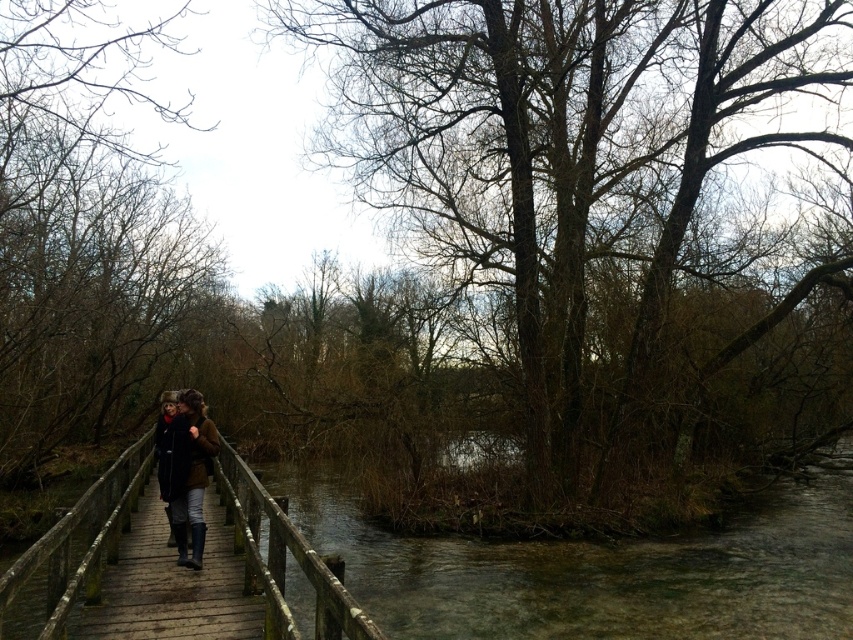
Question: Considering the relative positions of brown leather jacket at center and black leather coat at center in the image provided, where is brown leather jacket at center located with respect to black leather coat at center?

Choices:
 (A) above
 (B) below

Answer: (A)

Question: Does wooden planks at center have a greater width compared to brown leather jacket at center?

Choices:
 (A) yes
 (B) no

Answer: (B)

Question: Which point is closer to the camera taking this photo?

Choices:
 (A) (94, 502)
 (B) (740, 589)
 (C) (166, 406)
 (D) (198, 412)

Answer: (A)

Question: Which object appears closest to the camera in this image?

Choices:
 (A) black leather coat at center
 (B) brown leather jacket at center

Answer: (B)

Question: From the image, what is the correct spatial relationship of clear water at center in relation to wooden planks at center?

Choices:
 (A) right
 (B) left

Answer: (A)

Question: Which of the following is the closest to the observer?

Choices:
 (A) brown leather jacket at center
 (B) black leather coat at center
 (C) clear water at center
 (D) wooden planks at center

Answer: (C)